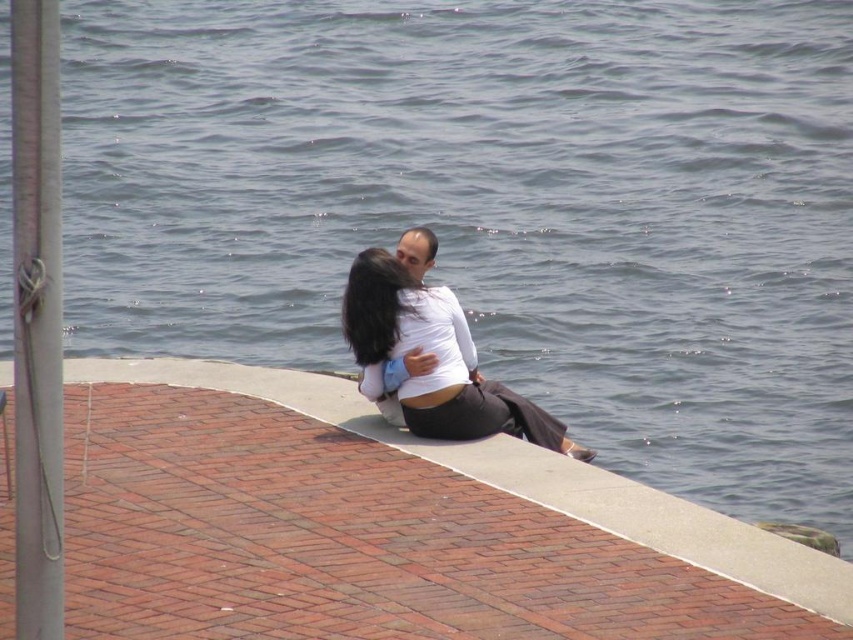
Question: Is metallic gray pole at left smaller than matte white blouse at center?

Choices:
 (A) no
 (B) yes

Answer: (B)

Question: Is metallic gray pole at left above matte white blouse at center?

Choices:
 (A) no
 (B) yes

Answer: (B)

Question: Can you confirm if concrete ledge at center is wider than metallic gray pole at left?

Choices:
 (A) no
 (B) yes

Answer: (B)

Question: Estimate the real-world distances between objects in this image. Which object is farther from the concrete ledge at center?

Choices:
 (A) matte white blouse at center
 (B) metallic gray pole at left

Answer: (B)

Question: Which object appears closest to the camera in this image?

Choices:
 (A) metallic gray pole at left
 (B) matte white blouse at center

Answer: (A)

Question: Which object appears closest to the camera in this image?

Choices:
 (A) metallic gray pole at left
 (B) concrete ledge at center
 (C) matte white blouse at center

Answer: (A)